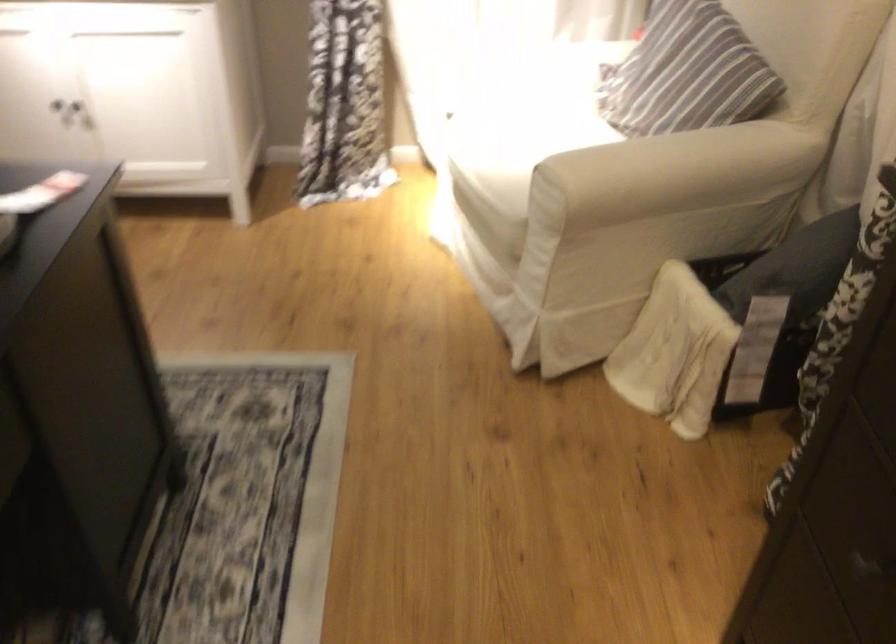
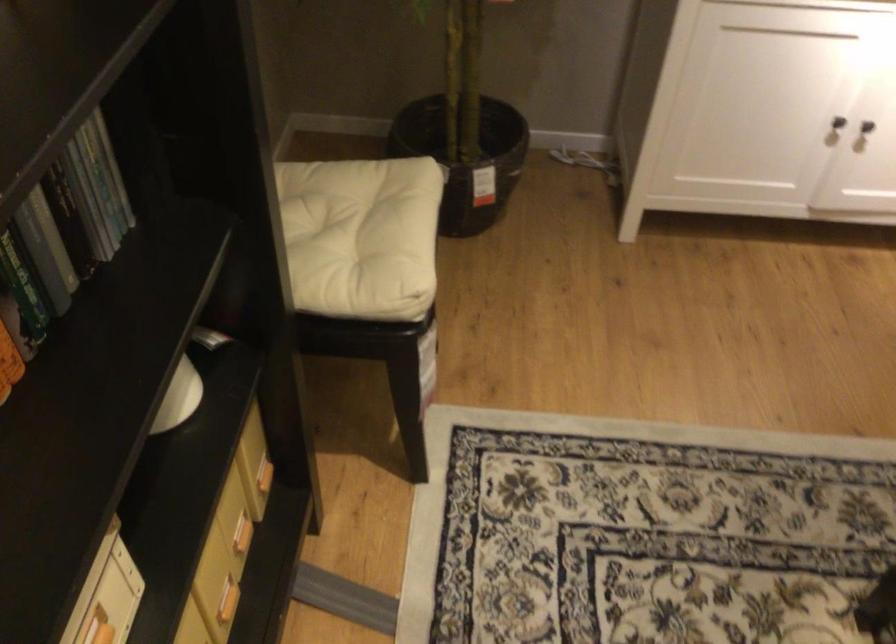
Find the pixel in the second image that matches (74,118) in the first image.

(866, 126)